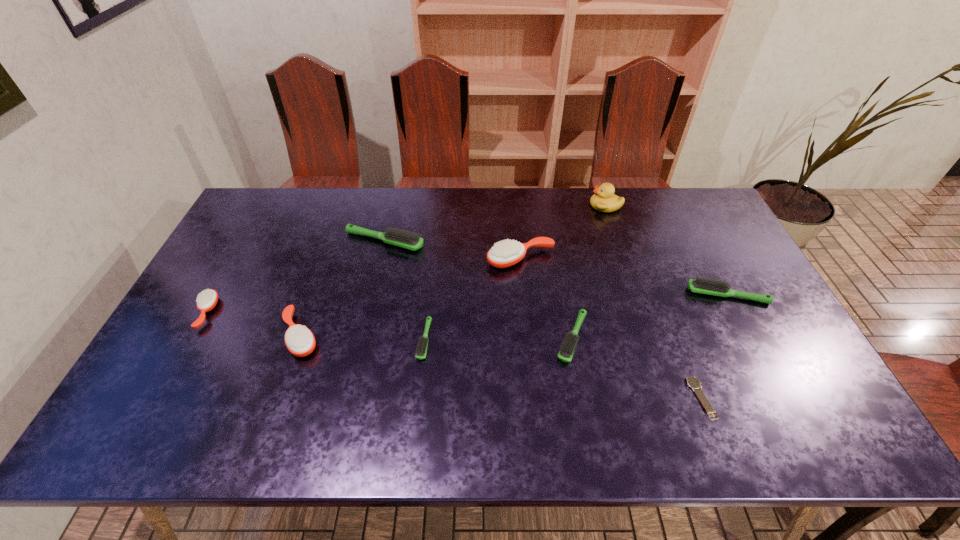
You are a GUI agent. You are given a task and a screenshot of the screen. Output one action in this format:
    pyautogui.click(x=<x>, y=<y>)
    Task: Click on the leftmost object
    
    Given the screenshot: What is the action you would take?
    pyautogui.click(x=206, y=301)

This screenshot has width=960, height=540. I want to click on the second smallest light hairbrush, so click(565, 354).

This screenshot has width=960, height=540. I want to click on the third light hairbrush from left to right, so click(x=565, y=354).

Locate an element on the screen. The width and height of the screenshot is (960, 540). the smallest light hairbrush is located at coordinates (421, 349).

Identify the location of the second light hairbrush from left to right. (421, 349).

Find the location of a particular element. Image resolution: width=960 pixels, height=540 pixels. the shortest object is located at coordinates (692, 381).

At what (x,y) coordinates should I click in order to perform the action: click on the nearest object. Please return your answer as a coordinate pair (x, y). The width and height of the screenshot is (960, 540). Looking at the image, I should click on (692, 381).

This screenshot has width=960, height=540. Find the location of `vacant space located 0.050m on the front-facing side of the yellow duckling`. vacant space located 0.050m on the front-facing side of the yellow duckling is located at coordinates (576, 205).

Locate an element on the screen. The width and height of the screenshot is (960, 540). vacant region located on the front-facing side of the yellow duckling is located at coordinates (554, 205).

Where is `free space located on the front-facing side of the yellow duckling`? This screenshot has width=960, height=540. free space located on the front-facing side of the yellow duckling is located at coordinates (523, 205).